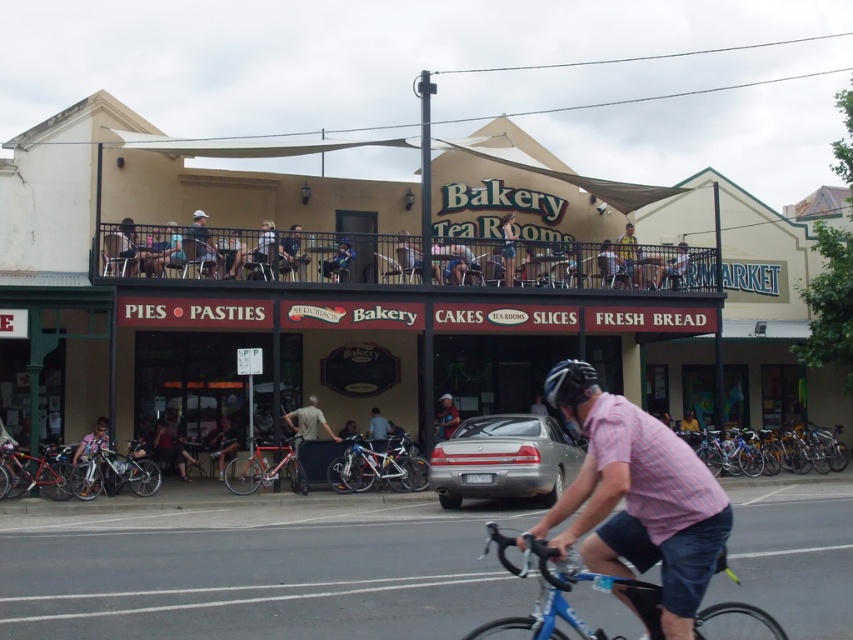
Is white matte bicycle helmet at center closer to camera compared to matte blue helmet at center?

Yes.

Which is in front, point (579, 371) or point (456, 412)?

Point (579, 371)

You are a GUI agent. You are given a task and a screenshot of the screen. Output one action in this format:
    pyautogui.click(x=<x>, y=<y>)
    Task: Click on the white matte bicycle helmet at center
    This screenshot has height=640, width=853.
    Given the screenshot: What is the action you would take?
    pyautogui.click(x=569, y=384)

Can you confirm if silver metallic bicycle at lower right is positioned to the left of shiny metallic bicycle at lower left?

Incorrect, silver metallic bicycle at lower right is not on the left side of shiny metallic bicycle at lower left.

In the scene shown: Who is positioned more to the right, silver metallic bicycle at lower right or shiny metallic bicycle at lower left?

From the viewer's perspective, silver metallic bicycle at lower right appears more on the right side.

This screenshot has height=640, width=853. Identify the location of silver metallic bicycle at lower right. (769, 451).

Who is positioned more to the right, blue metallic bicycle at lower right or light blue helmet at upper center?

light blue helmet at upper center is more to the right.

Which is below, blue metallic bicycle at lower right or light blue helmet at upper center?

blue metallic bicycle at lower right

Is point (627, 579) positioned in front of point (508, 243)?

Yes, it is.

The height and width of the screenshot is (640, 853). Find the location of `blue metallic bicycle at lower right`. blue metallic bicycle at lower right is located at coordinates (561, 595).